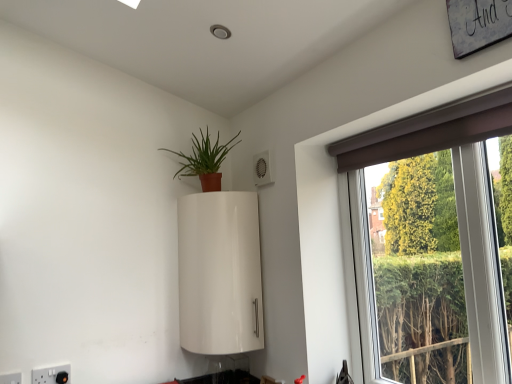
Question: From a real-world perspective, relative to brown fabric window at upper right, is white glossy cabinet at upper center vertically above or below?

Choices:
 (A) below
 (B) above

Answer: (A)

Question: Visually, is white glossy cabinet at upper center positioned to the left or to the right of brown fabric window at upper right?

Choices:
 (A) right
 (B) left

Answer: (B)

Question: Which of these objects is positioned farthest from the white plastic electric outlet at lower left, which is the 2th electric outlet in back-to-front order?

Choices:
 (A) matte terracotta pot at upper center
 (B) white glossy cabinet at upper center
 (C) brown fabric window at upper right
 (D) white plastic electric outlet at lower left, the 2th electric outlet positioned from the left

Answer: (C)

Question: Which object is the closest to the matte terracotta pot at upper center?

Choices:
 (A) brown fabric window at upper right
 (B) white plastic electric outlet at lower left, placed as the first electric outlet when sorted from left to right
 (C) white plastic electric outlet at lower left, the 2th electric outlet positioned from the left
 (D) white glossy cabinet at upper center

Answer: (D)